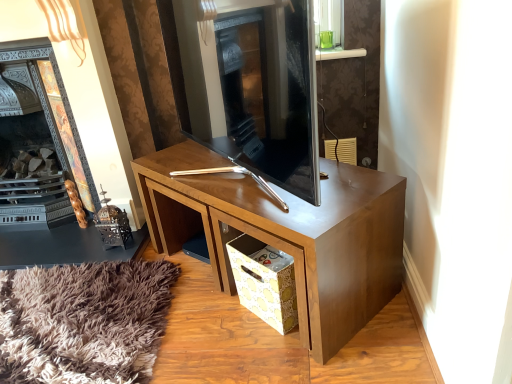
Question: In terms of height, does dark gray stone fireplace at center, which ranks as the first fireplace in right-to-left order, look taller or shorter compared to wooden desk at center?

Choices:
 (A) short
 (B) tall

Answer: (B)

Question: Would you say dark gray stone fireplace at center, which ranks as the 2th fireplace in left-to-right order, is inside or outside wooden desk at center?

Choices:
 (A) outside
 (B) inside

Answer: (A)

Question: Considering the real-world distances, which object is closest to the dark gray stone fireplace at center, which ranks as the 2th fireplace in left-to-right order?

Choices:
 (A) dark wood fireplace at left, arranged as the 2th fireplace when viewed from the right
 (B) wooden desk at center
 (C) yellow paper bag at lower center

Answer: (B)

Question: Estimate the real-world distances between objects in this image. Which object is closer to the yellow paper bag at lower center?

Choices:
 (A) wooden desk at center
 (B) dark gray stone fireplace at center, which ranks as the 2th fireplace in left-to-right order
 (C) dark wood fireplace at left, arranged as the 2th fireplace when viewed from the right

Answer: (A)